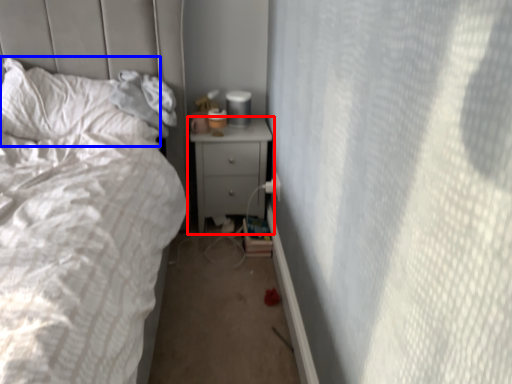
Question: Which of the following is the closest to the observer, nightstand (highlighted by a red box) or pillow (highlighted by a blue box)?

Choices:
 (A) nightstand
 (B) pillow

Answer: (B)